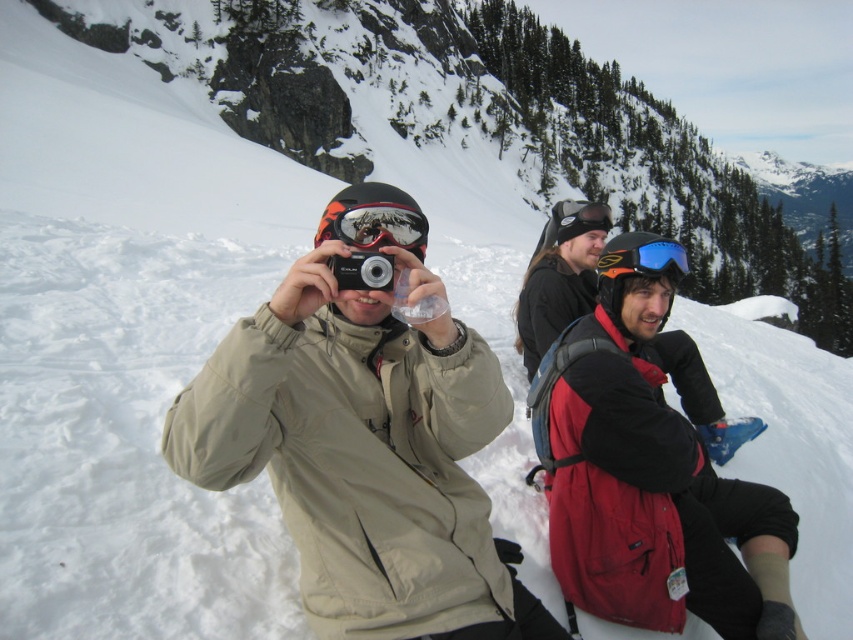
Does matte black goggles at center appear over blue reflective goggles at upper center?

Incorrect, matte black goggles at center is not positioned above blue reflective goggles at upper center.

Is matte black goggles at center below blue reflective goggles at upper center?

Correct, matte black goggles at center is located below blue reflective goggles at upper center.

Identify the location of matte black goggles at center. The width and height of the screenshot is (853, 640). (376, 225).

Who is taller, matte khaki jacket at center or matte black goggles at center?

With more height is matte khaki jacket at center.

Does matte khaki jacket at center have a smaller size compared to matte black goggles at center?

No.

Identify the location of matte khaki jacket at center. The width and height of the screenshot is (853, 640). (363, 458).

Is matte khaki jacket at center bigger than blue reflective lens goggles at upper center?

Indeed, matte khaki jacket at center has a larger size compared to blue reflective lens goggles at upper center.

Which is below, matte khaki jacket at center or blue reflective lens goggles at upper center?

Positioned lower is matte khaki jacket at center.

You are a GUI agent. You are given a task and a screenshot of the screen. Output one action in this format:
    pyautogui.click(x=<x>, y=<y>)
    Task: Click on the matte khaki jacket at center
    This screenshot has height=640, width=853.
    Given the screenshot: What is the action you would take?
    pyautogui.click(x=363, y=458)

The height and width of the screenshot is (640, 853). I want to click on matte khaki jacket at center, so click(363, 458).